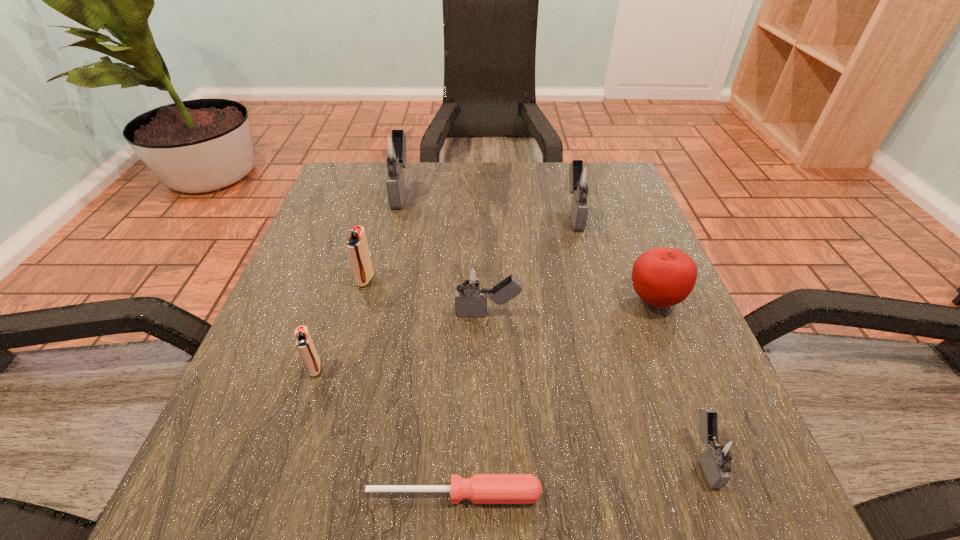
In the image, there is a desktop. Identify the location of free region at the left edge. point(273,373).

Where is `vacant space at the right edge of the desktop`? The width and height of the screenshot is (960, 540). vacant space at the right edge of the desktop is located at coordinates (672, 377).

You are a GUI agent. You are given a task and a screenshot of the screen. Output one action in this format:
    pyautogui.click(x=<x>, y=<y>)
    Task: Click on the vacant space at the far left corner of the desktop
    This screenshot has width=960, height=540.
    Given the screenshot: What is the action you would take?
    pyautogui.click(x=384, y=185)

This screenshot has width=960, height=540. What are the coordinates of `vacant space at the far right corner of the desktop` in the screenshot? It's located at (597, 214).

Find the location of a particular element. The height and width of the screenshot is (540, 960). vacant space at the near right corner of the desktop is located at coordinates (754, 501).

At what (x,y) coordinates should I click in order to perform the action: click on free space between the apple and the rightmost gray igniter. Please return your answer as a coordinate pair (x, y). This screenshot has height=540, width=960. Looking at the image, I should click on (680, 379).

Identify the location of empty location between the second smallest gray igniter and the rightmost gray igniter. Image resolution: width=960 pixels, height=540 pixels. (596, 386).

Where is `free point between the fourth farthest igniter and the screwdriver`? The width and height of the screenshot is (960, 540). free point between the fourth farthest igniter and the screwdriver is located at coordinates (471, 404).

The width and height of the screenshot is (960, 540). In order to click on free space that is in between the seventh shortest object and the rightmost igniter in this screenshot , I will do `click(639, 335)`.

Where is `vacant area between the third gray igniter from right to left and the biggest gray igniter`? vacant area between the third gray igniter from right to left and the biggest gray igniter is located at coordinates (444, 252).